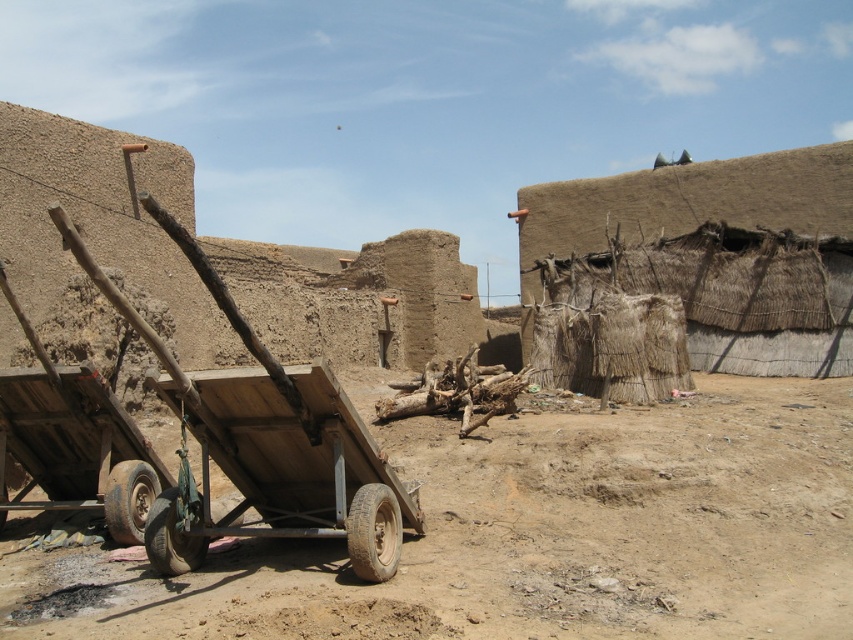
Question: Does brown sandy dirt at lower left lie in front of wooden wagon at center?

Choices:
 (A) yes
 (B) no

Answer: (A)

Question: Is the position of brown sandy dirt at lower left more distant than that of wooden wagon at center?

Choices:
 (A) no
 (B) yes

Answer: (A)

Question: Which of the following is the closest to the observer?

Choices:
 (A) brown sandy dirt at lower left
 (B) wooden wagon at center

Answer: (A)

Question: Which of the following is the farthest from the observer?

Choices:
 (A) (206, 570)
 (B) (253, 406)

Answer: (A)

Question: Is brown sandy dirt at lower left thinner than wooden wagon at center?

Choices:
 (A) yes
 (B) no

Answer: (B)

Question: Which point is closer to the camera?

Choices:
 (A) brown sandy dirt at lower left
 (B) wooden wagon at center

Answer: (A)